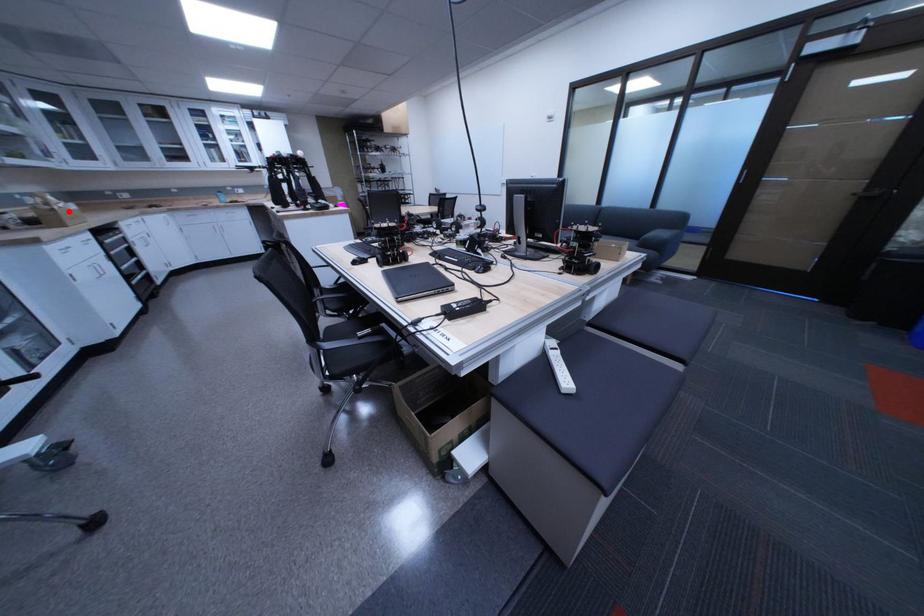
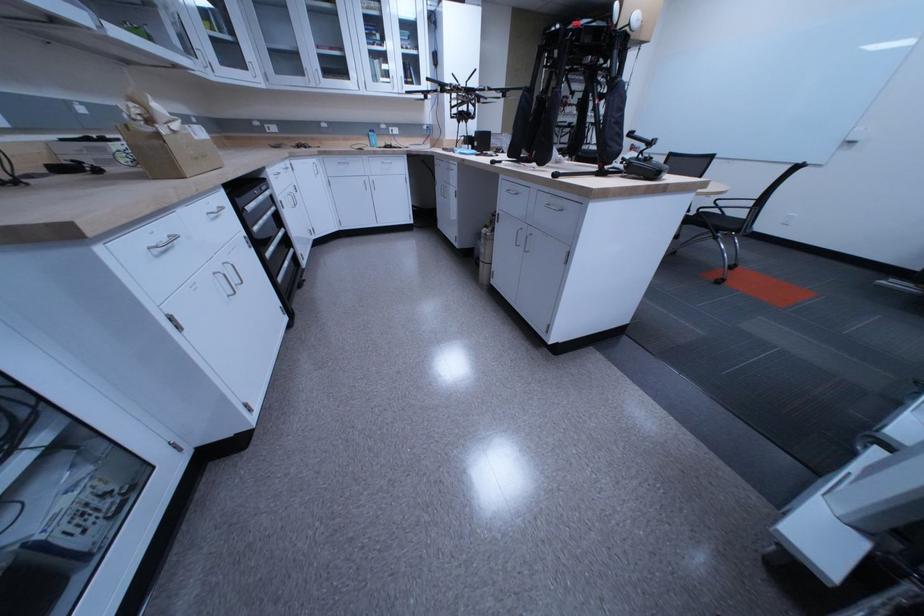
Question: I am providing you with two images of the same scene from different viewpoints. Given a red point in image1, look at the same physical point in image2. Is it:

Choices:
 (A) Closer to the viewpoint
 (B) Farther from the viewpoint

Answer: (A)